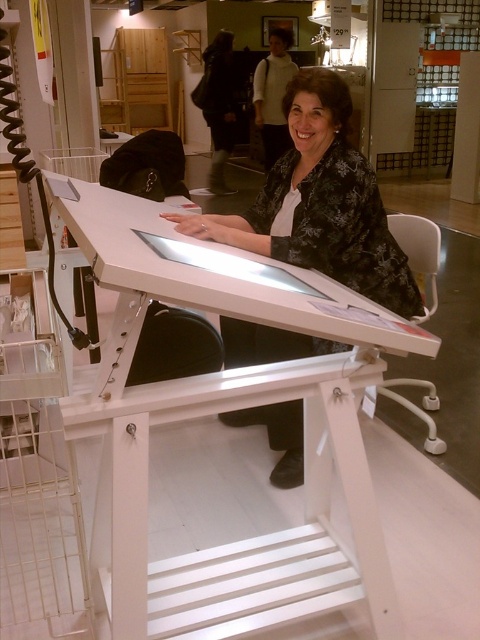
Does white matte table at center appear under black floral blouse at center?

Yes.

Image resolution: width=480 pixels, height=640 pixels. What do you see at coordinates (232, 410) in the screenshot?
I see `white matte table at center` at bounding box center [232, 410].

This screenshot has width=480, height=640. I want to click on white matte table at center, so click(232, 410).